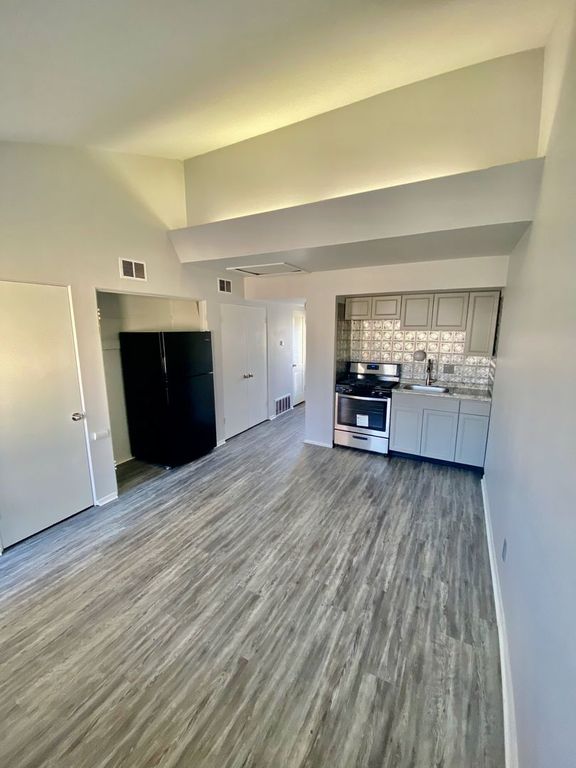
This screenshot has width=576, height=768. I want to click on door, so click(15, 445).